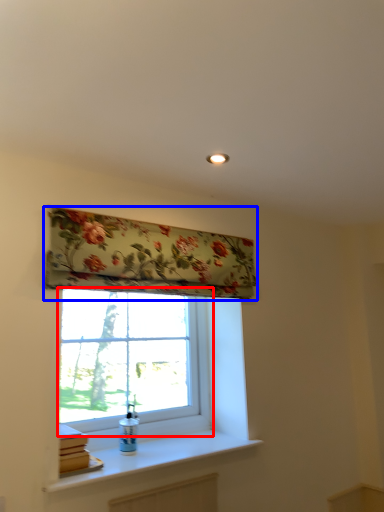
Question: Which object is closer to the camera taking this photo, window (highlighted by a red box) or window blind (highlighted by a blue box)?

Choices:
 (A) window
 (B) window blind

Answer: (B)